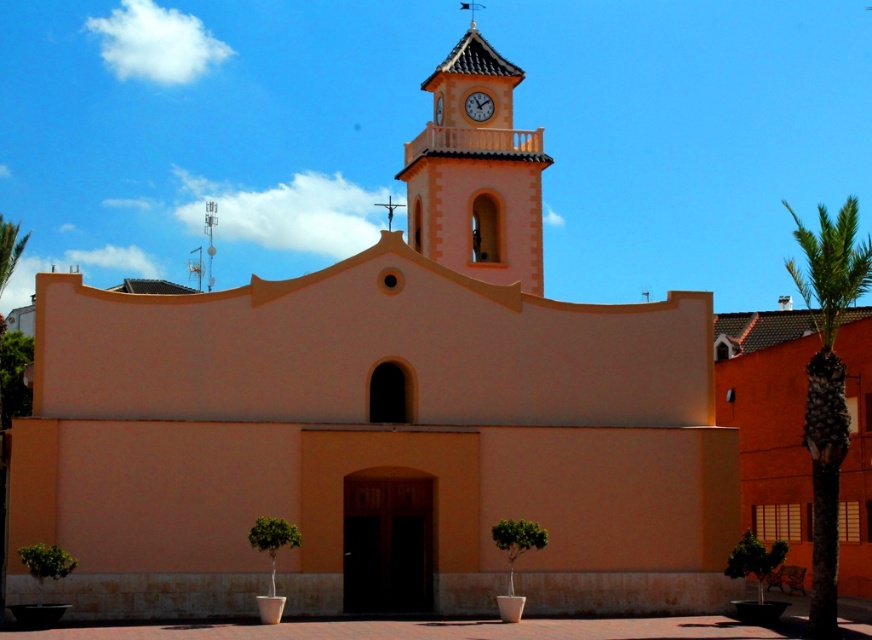
You are standing in front of the church and want to take a photo that includes both the matte orange clock tower at upper center and the metallic spire at upper center. Which object should you position closer to the center of your camera frame to ensure both are fully visible?

Since the matte orange clock tower at upper center is larger than the metallic spire at upper center, you should position the matte orange clock tower at upper center closer to the center of your camera frame to ensure both are fully visible.

You are standing in front of the church and want to take a photo that includes both the matte orange clock tower at upper center and the metallic spire at upper center. Which one of these objects will appear taller in your photo?

The matte orange clock tower at upper center is much taller than the metallic spire at upper center, so it will appear taller in the photo.

You are standing in front of the church and want to take a photo that includes both the green leafy palm tree at right and the green leafy palm tree at left. Which palm tree should you position to your left side to include both in the frame?

To include both the green leafy palm tree at right and the green leafy palm tree at left in the frame, position the green leafy palm tree at left to your left side since it is located to the left of the green leafy palm tree at right.